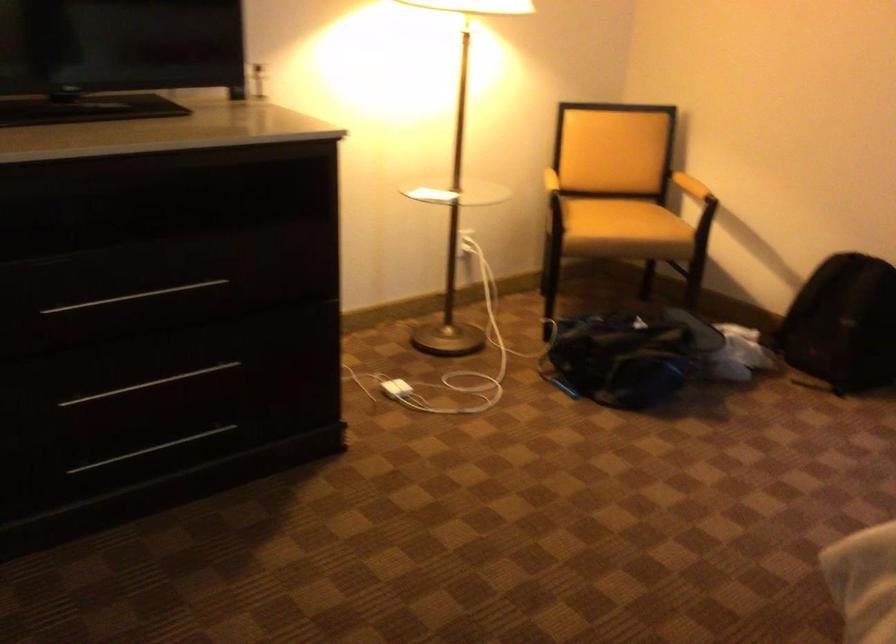
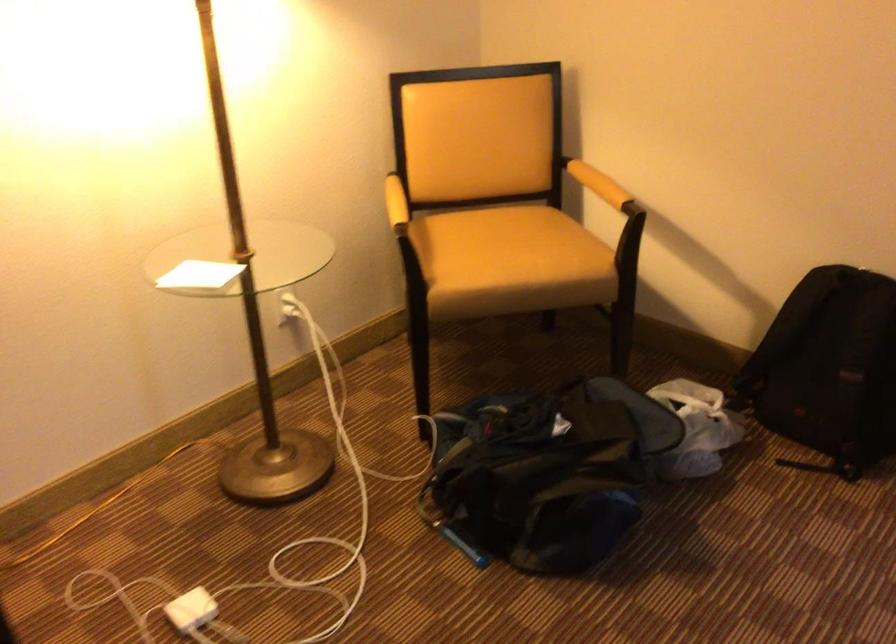
Find the pixel in the second image that matches point (421, 194) in the first image.

(199, 275)